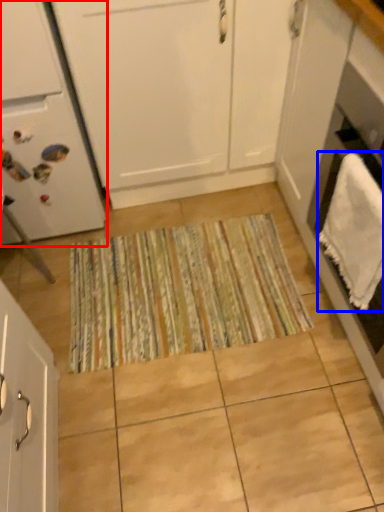
Question: Which of the following is the closest to the observer, home appliance (highlighted by a red box) or bath towel (highlighted by a blue box)?

Choices:
 (A) home appliance
 (B) bath towel

Answer: (B)